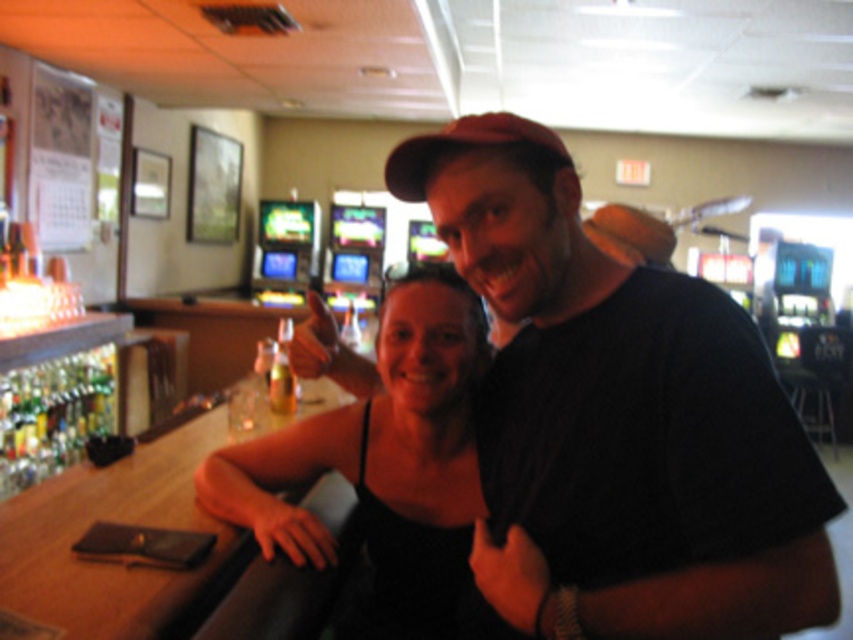
Question: Does black matte t-shirt at center have a larger size compared to translucent glass bottle at bar?

Choices:
 (A) yes
 (B) no

Answer: (A)

Question: Which object appears closest to the camera in this image?

Choices:
 (A) green glass bottle at bar
 (B) black fabric dress at center
 (C) translucent glass bottle at bar

Answer: (B)

Question: Is black matte t-shirt at center thinner than translucent glass bottle at bar?

Choices:
 (A) yes
 (B) no

Answer: (B)

Question: Which object appears closest to the camera in this image?

Choices:
 (A) black matte t-shirt at center
 (B) green glass bottle at bar
 (C) black fabric dress at center
 (D) translucent glass bottle at bar

Answer: (A)

Question: Can you confirm if black matte t-shirt at center is thinner than green glass bottle at bar?

Choices:
 (A) no
 (B) yes

Answer: (A)

Question: Among these objects, which one is nearest to the camera?

Choices:
 (A) green glass bottle at bar
 (B) black matte t-shirt at center

Answer: (B)